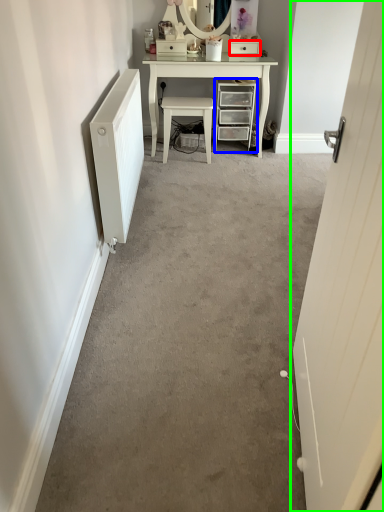
Question: Which is nearer to the drawer (highlighted by a red box)? chest of drawers (highlighted by a blue box) or door (highlighted by a green box).

Choices:
 (A) chest of drawers
 (B) door

Answer: (A)